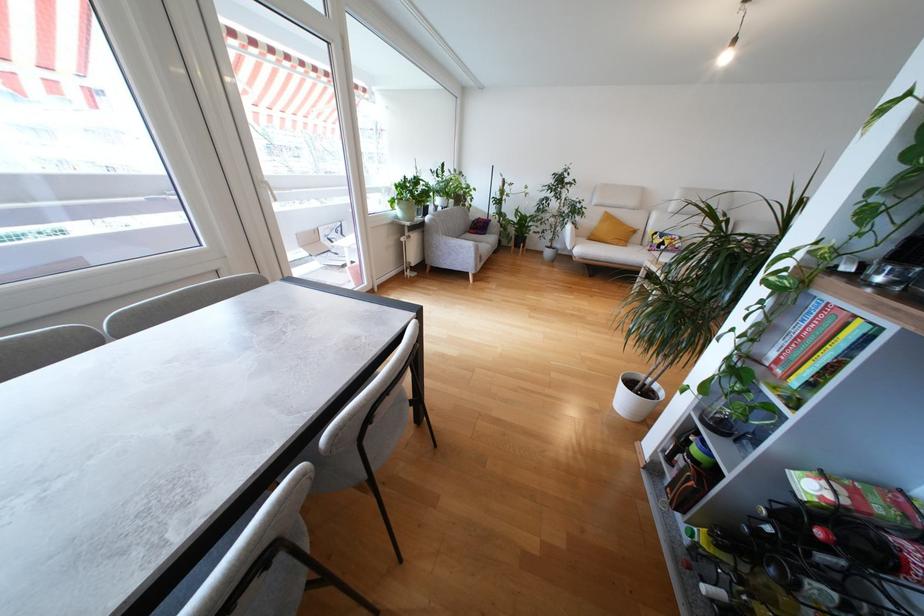
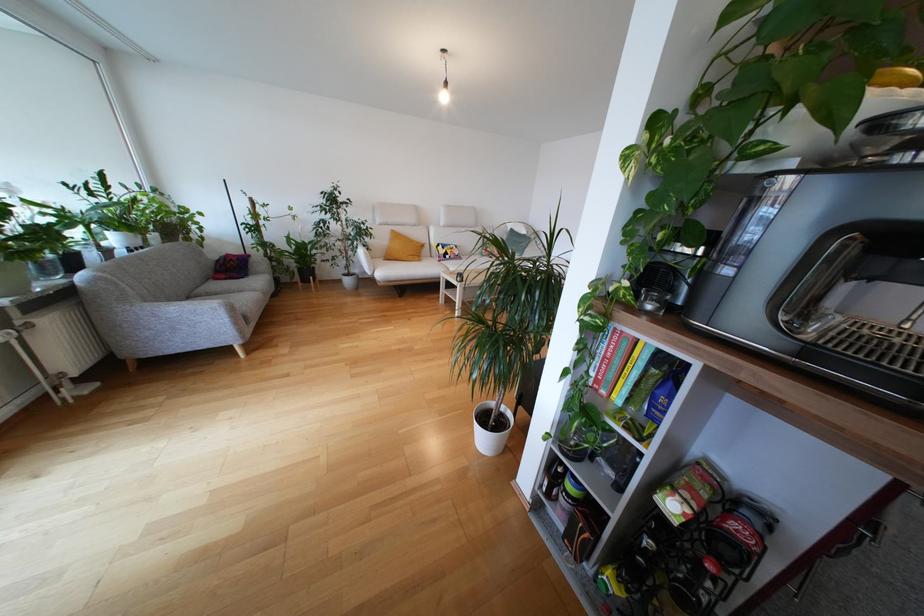
In the second image, find the point that corresponds to pixel 642 395 in the first image.

(497, 427)